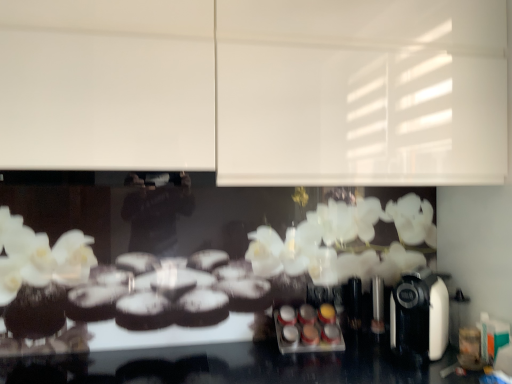
Image resolution: width=512 pixels, height=384 pixels. What do you see at coordinates (258, 89) in the screenshot?
I see `white matte cabinet at upper center` at bounding box center [258, 89].

The height and width of the screenshot is (384, 512). I want to click on black plastic coffee machine at right, so click(x=419, y=316).

You are a GUI agent. You are given a task and a screenshot of the screen. Output one action in this format:
    pyautogui.click(x=<x>, y=<y>)
    Task: Click on the backdrop lying on the left of black plastic coffee machine at right
    The width and height of the screenshot is (512, 384).
    Given the screenshot: What is the action you would take?
    pyautogui.click(x=258, y=89)

Is white matte cabinet at upper center behind black plastic coffee machine at right?

No, white matte cabinet at upper center is in front of black plastic coffee machine at right.

Is white matte cabinet at upper center facing towards black plastic coffee machine at right?

No, white matte cabinet at upper center is not facing towards black plastic coffee machine at right.

Between white matte cabinet at upper center and black plastic coffee machine at right, which one has smaller width?

Thinner between the two is white matte cabinet at upper center.

Are white matte cabinet at upper center and metallic silver spice rack at center located far from each other?

white matte cabinet at upper center is near metallic silver spice rack at center, not far away.

Does point (371, 53) come closer to viewer compared to point (314, 311)?

Yes, point (371, 53) is in front of point (314, 311).

In terms of width, does white matte cabinet at upper center look wider or thinner when compared to metallic silver spice rack at center?

In the image, white matte cabinet at upper center appears to be wider than metallic silver spice rack at center.

At what (x,y) coordinates should I click in order to perform the action: click on backdrop that appears above the metallic silver spice rack at center (from a real-world perspective). Please return your answer as a coordinate pair (x, y). This screenshot has width=512, height=384. Looking at the image, I should click on (258, 89).

Considering the relative sizes of metallic silver spice rack at center and white matte cabinet at upper center in the image provided, is metallic silver spice rack at center taller than white matte cabinet at upper center?

Incorrect, the height of metallic silver spice rack at center is not larger of that of white matte cabinet at upper center.

Is point (330, 342) closer to camera compared to point (125, 150)?

No.

Where is `backdrop lying above the metallic silver spice rack at center (from the image's perspective)`? The image size is (512, 384). backdrop lying above the metallic silver spice rack at center (from the image's perspective) is located at coordinates (258, 89).

How different are the orientations of metallic silver spice rack at center and white matte cabinet at upper center in degrees?

0.309 degrees.

From the image's perspective, which one is positioned higher, black plastic coffee machine at right or white matte cabinet at upper center?

white matte cabinet at upper center appears higher in the image.

Which object is wider, black plastic coffee machine at right or white matte cabinet at upper center?

black plastic coffee machine at right is wider.

Would you say black plastic coffee machine at right contains white matte cabinet at upper center?

No, white matte cabinet at upper center is located outside of black plastic coffee machine at right.

Is point (447, 292) farther from viewer compared to point (41, 35)?

Yes, point (447, 292) is farther from viewer.

Is black plastic coffee machine at right completely or partially inside metallic silver spice rack at center?

No, metallic silver spice rack at center does not contain black plastic coffee machine at right.

Can you confirm if metallic silver spice rack at center is smaller than black plastic coffee machine at right?

Indeed, metallic silver spice rack at center has a smaller size compared to black plastic coffee machine at right.

Does metallic silver spice rack at center have a lesser height compared to black plastic coffee machine at right?

Indeed, metallic silver spice rack at center has a lesser height compared to black plastic coffee machine at right.

Is metallic silver spice rack at center not close to black plastic coffee machine at right?

No, metallic silver spice rack at center is not far away from black plastic coffee machine at right.

From a real-world perspective, is black plastic coffee machine at right below metallic silver spice rack at center?

No, from a real-world perspective, black plastic coffee machine at right is not beneath metallic silver spice rack at center.

Based on the photo, considering the sizes of objects black plastic coffee machine at right and metallic silver spice rack at center in the image provided, who is smaller, black plastic coffee machine at right or metallic silver spice rack at center?

Smaller between the two is metallic silver spice rack at center.

Can you confirm if black plastic coffee machine at right is wider than metallic silver spice rack at center?

Yes, black plastic coffee machine at right is wider than metallic silver spice rack at center.

The width and height of the screenshot is (512, 384). I want to click on food that is under the black plastic coffee machine at right (from a real-world perspective), so click(307, 330).

The image size is (512, 384). In order to click on backdrop above the black plastic coffee machine at right (from a real-world perspective) in this screenshot , I will do `click(258, 89)`.

The height and width of the screenshot is (384, 512). In order to click on backdrop above the metallic silver spice rack at center (from the image's perspective) in this screenshot , I will do `click(258, 89)`.

Estimate the real-world distances between objects in this image. Which object is further from white matte cabinet at upper center, black plastic coffee machine at right or metallic silver spice rack at center?

Among the two, metallic silver spice rack at center is located further to white matte cabinet at upper center.

When comparing their distances from white matte cabinet at upper center, does metallic silver spice rack at center or black plastic coffee machine at right seem further?

Among the two, metallic silver spice rack at center is located further to white matte cabinet at upper center.

Looking at the image, which one is located closer to metallic silver spice rack at center, black plastic coffee machine at right or white matte cabinet at upper center?

black plastic coffee machine at right lies closer to metallic silver spice rack at center than the other object.

Estimate the real-world distances between objects in this image. Which object is closer to black plastic coffee machine at right, metallic silver spice rack at center or white matte cabinet at upper center?

Among the two, metallic silver spice rack at center is located nearer to black plastic coffee machine at right.

Considering their positions, is white matte cabinet at upper center positioned closer to black plastic coffee machine at right than metallic silver spice rack at center?

metallic silver spice rack at center is positioned closer to the anchor black plastic coffee machine at right.

Considering their positions, is white matte cabinet at upper center positioned closer to metallic silver spice rack at center than black plastic coffee machine at right?

black plastic coffee machine at right lies closer to metallic silver spice rack at center than the other object.

This screenshot has height=384, width=512. Find the location of `coffee machine between white matte cabinet at upper center and metallic silver spice rack at center in the up-down direction`. coffee machine between white matte cabinet at upper center and metallic silver spice rack at center in the up-down direction is located at coordinates (419, 316).